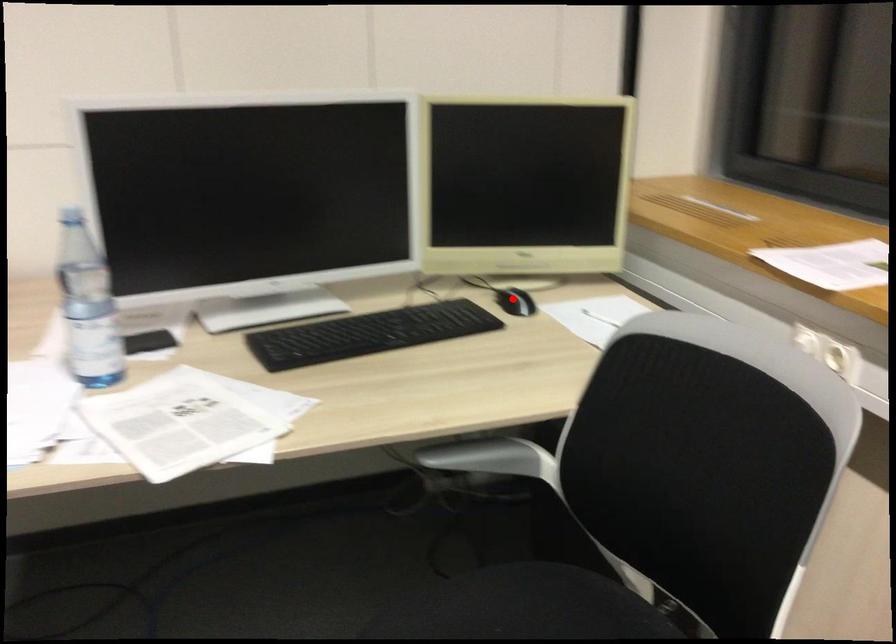
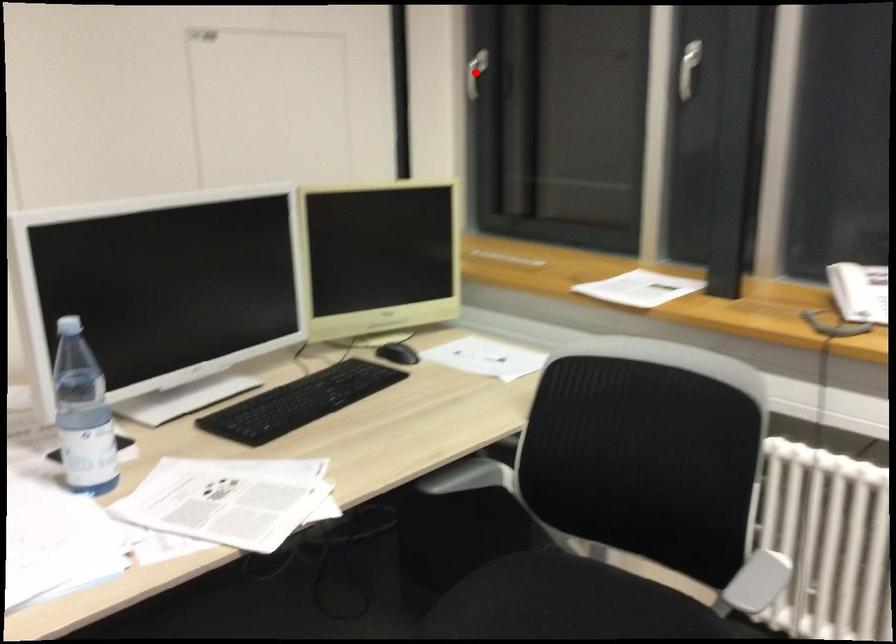
I am providing you with two images of the same scene from different viewpoints. A red point is marked on the first image and another point is marked on the second image. Is the red point in image1 aligned with the point shown in image2?

No